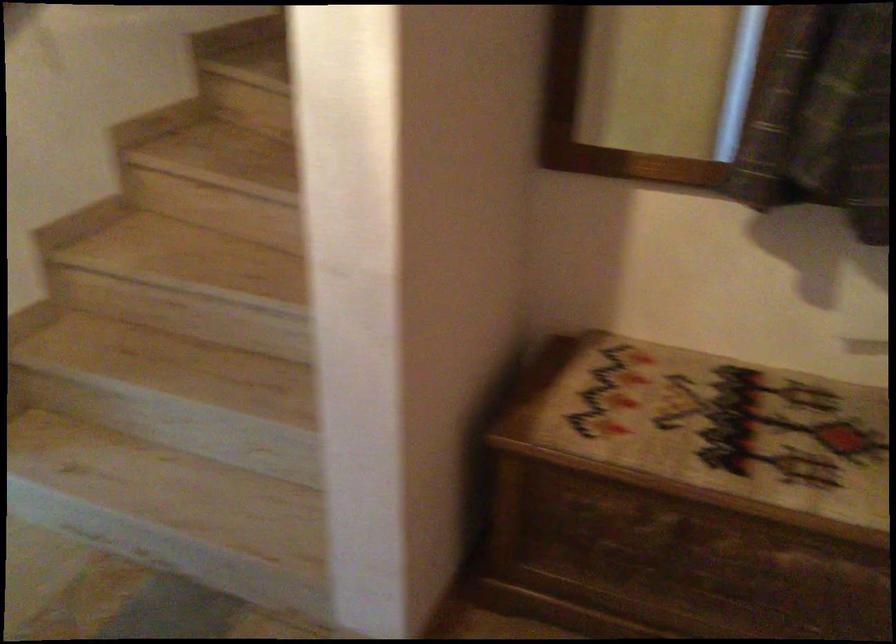
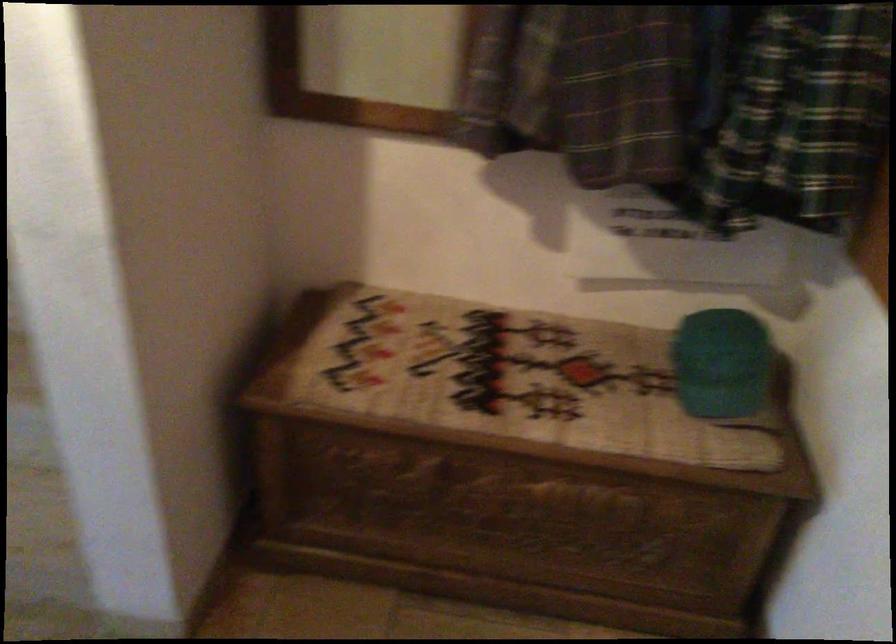
Question: In a continuous first-person perspective shot, in which direction is the camera moving?

Choices:
 (A) Left
 (B) Right
 (C) Forward
 (D) Backward

Answer: (B)